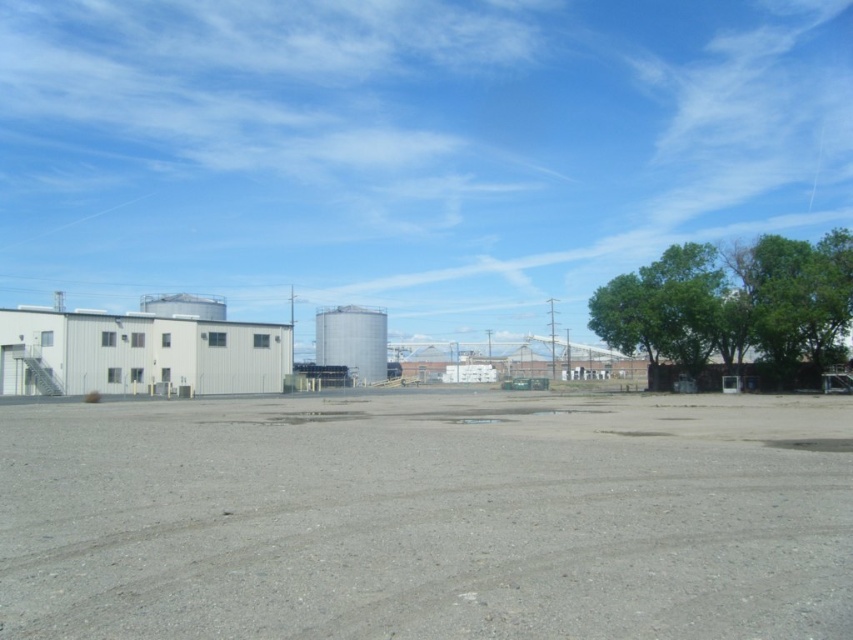
Question: Among these points, which one is nearest to the camera?

Choices:
 (A) (740, 282)
 (B) (315, 355)
 (C) (821, 256)

Answer: (C)

Question: Which point is closer to the camera?

Choices:
 (A) (757, 577)
 (B) (711, 355)
 (C) (781, 275)
 (D) (357, 380)

Answer: (A)

Question: Can you confirm if green leafy tree at right is positioned above green leafy tree at upper right?

Choices:
 (A) no
 (B) yes

Answer: (A)

Question: Does green leafy tree at right have a lesser width compared to green leafy tree at upper right?

Choices:
 (A) yes
 (B) no

Answer: (B)

Question: Which of these objects is positioned closest to the green leafy tree at upper right?

Choices:
 (A) gray gravel dirt track at center
 (B) silver metallic silo at center
 (C) green leafy tree at right

Answer: (C)

Question: Can you confirm if gray gravel dirt track at center is thinner than green leafy tree at upper right?

Choices:
 (A) yes
 (B) no

Answer: (B)